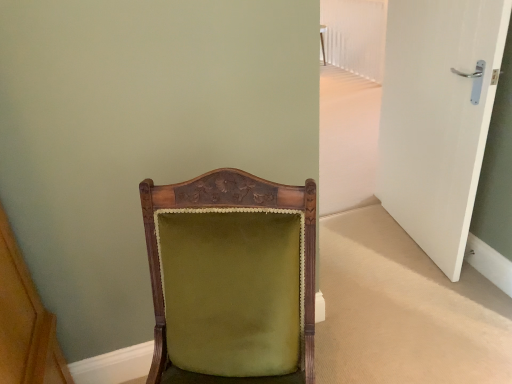
At what (x,y) coordinates should I click in order to perform the action: click on vacant area to the left of white glossy door at right. Please return your answer as a coordinate pair (x, y). Looking at the image, I should click on (369, 249).